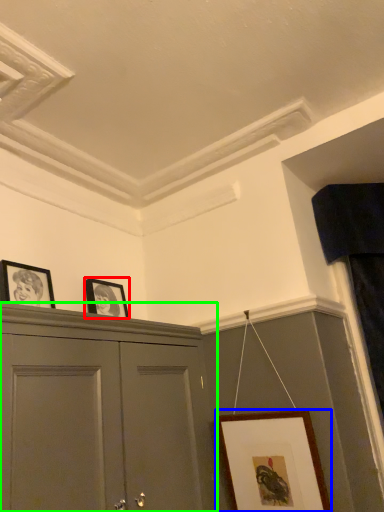
Question: Estimate the real-world distances between objects in this image. Which object is farther from picture frame (highlighted by a red box), picture frame (highlighted by a blue box) or cabinetry (highlighted by a green box)?

Choices:
 (A) picture frame
 (B) cabinetry

Answer: (A)